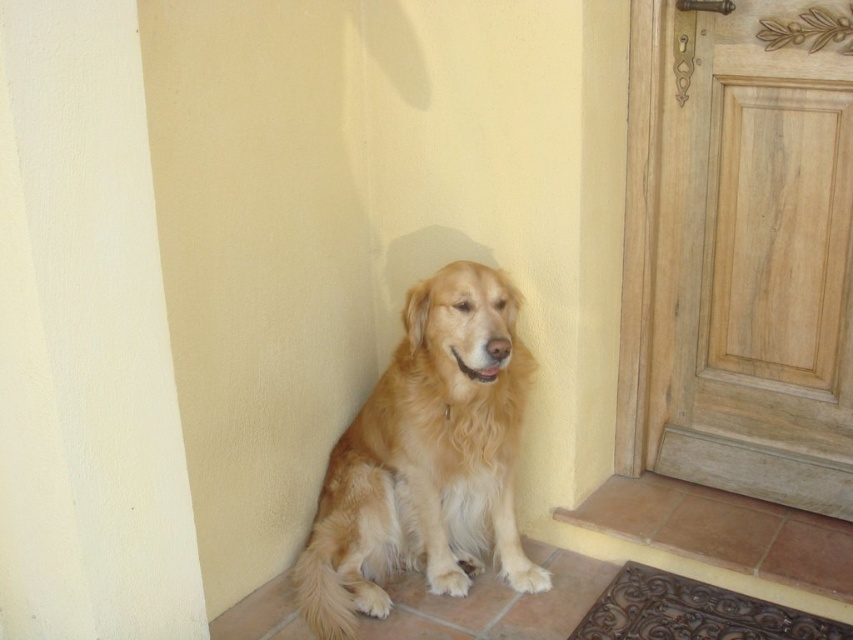
Does light brown wood door at right have a smaller size compared to golden fur dog at center?

No.

You are a GUI agent. You are given a task and a screenshot of the screen. Output one action in this format:
    pyautogui.click(x=<x>, y=<y>)
    Task: Click on the light brown wood door at right
    
    Given the screenshot: What is the action you would take?
    pyautogui.click(x=746, y=248)